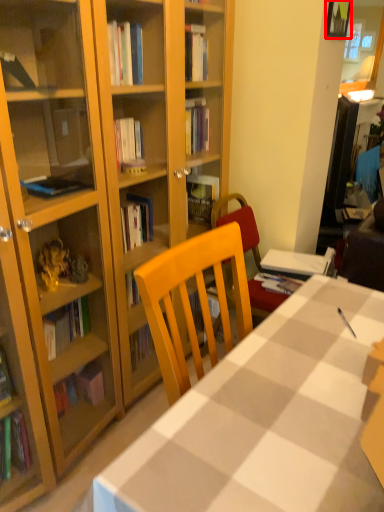
Question: Where is picture frame (annotated by the red box) located in relation to desk in the image?

Choices:
 (A) right
 (B) left

Answer: (A)